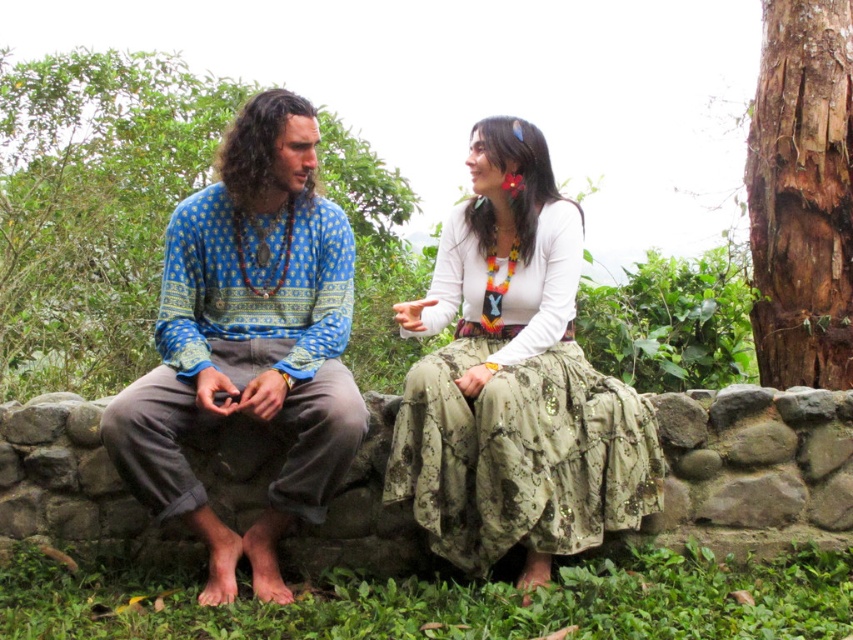
You are a delivery robot that is 3 feet wide. You need to move from the blue printed shirt at center to the gray stone wall at center. Is there enough space for you to pass between them?

The blue printed shirt at center and gray stone wall at center are 4.47 feet apart, so yes, the robot can pass between them since the distance is greater than the robot width of 3 feet.

You are standing in the outdoor setting and want to place a small marker at point (248, 340). Which object from the scene will the marker be placed on?

The point (248, 340) is on the blue printed shirt at left, so the marker will be placed on the blue printed shirt at left.

You are a photographer trying to capture the perfect shot of the blue printed shirt at center. According to the coordinates provided, where should you position your camera to ensure the shirt is centered in the frame?

The blue printed shirt at center is located at coordinates point (247, 342), so positioning the camera to center the frame at that point will ensure the shirt is centered.